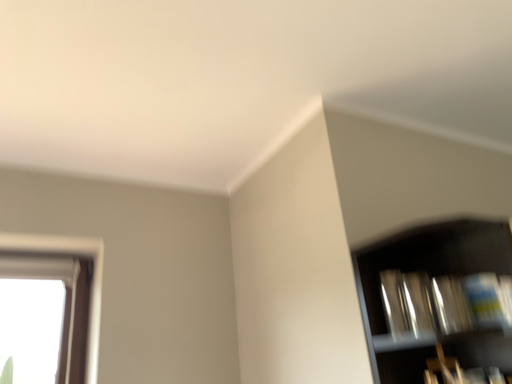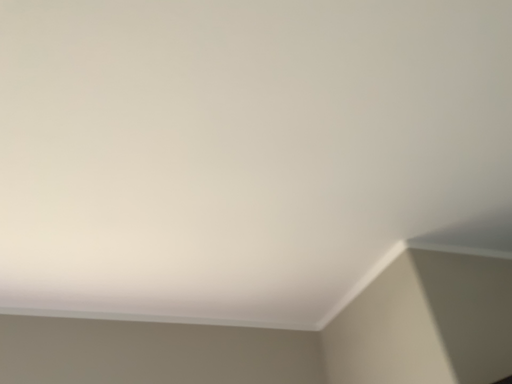
Question: Which way did the camera rotate in the video?

Choices:
 (A) rotated downward
 (B) rotated upward

Answer: (B)